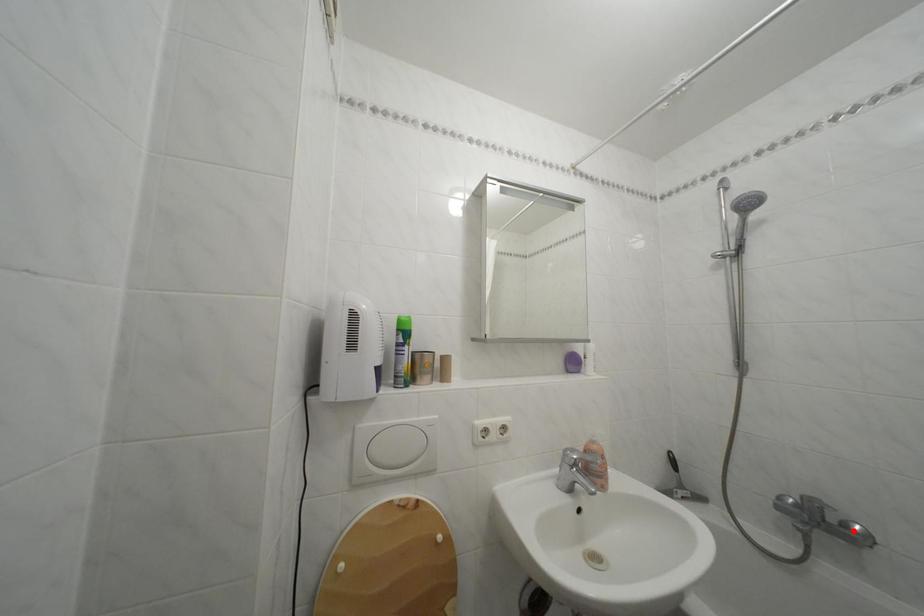
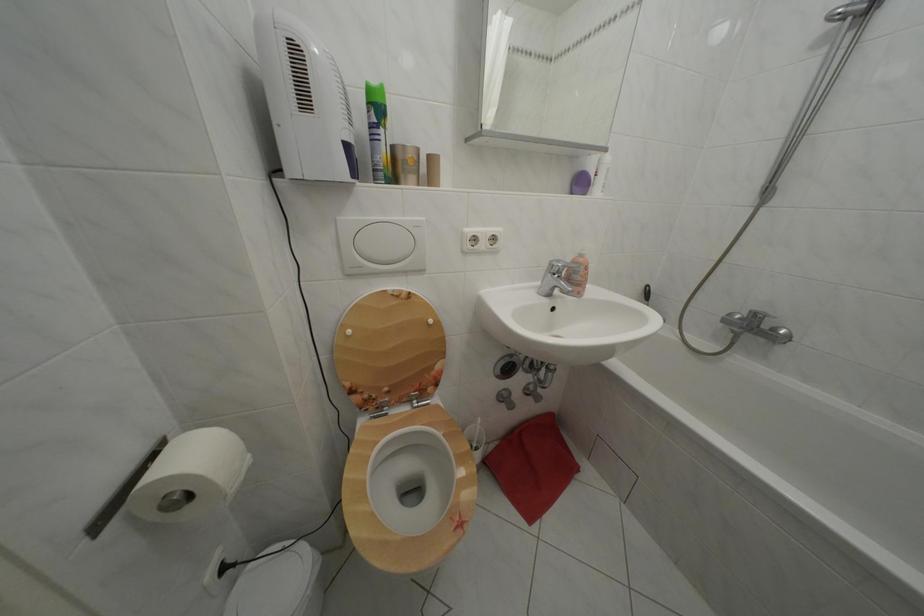
Find the pixel in the second image that matches the highlighted location in the first image.

(783, 336)